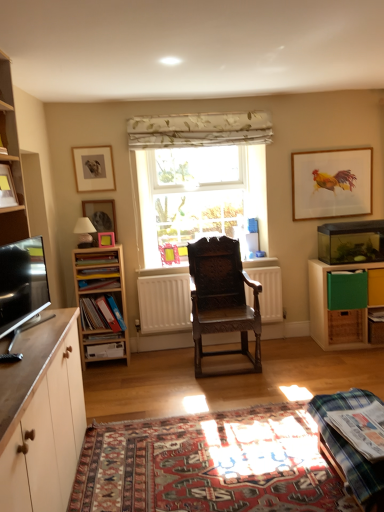
Image resolution: width=384 pixels, height=512 pixels. I want to click on free space above carpet at center (from a real-world perspective), so click(210, 453).